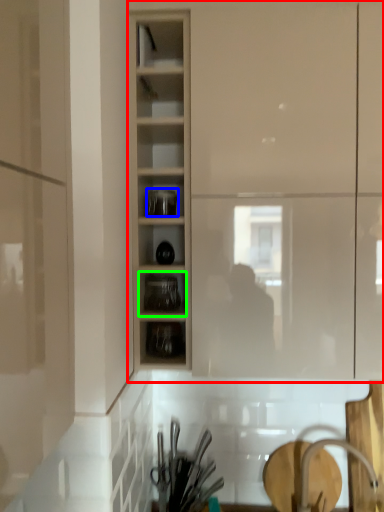
Question: Which object is the farthest from cupboard (highlighted by a red box)? Choose among these: tableware (highlighted by a blue box) or shelf (highlighted by a green box).

Choices:
 (A) tableware
 (B) shelf

Answer: (B)